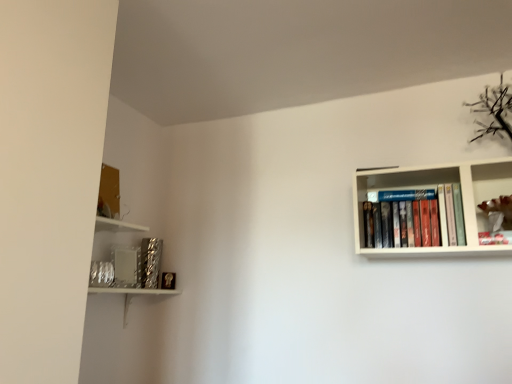
Question: From a real-world perspective, is metallic textured book at lower left positioned above or below hardcover books at upper right?

Choices:
 (A) below
 (B) above

Answer: (A)

Question: Which is correct: metallic textured book at lower left is inside hardcover books at upper right, or outside of it?

Choices:
 (A) outside
 (B) inside

Answer: (A)

Question: Which of these objects is positioned farthest from the metallic silver frame at upper right?

Choices:
 (A) hardcover books at upper right
 (B) metallic textured book at lower left

Answer: (B)

Question: Estimate the real-world distances between objects in this image. Which object is closer to the hardcover books at upper right?

Choices:
 (A) metallic silver frame at upper right
 (B) metallic textured book at lower left

Answer: (A)